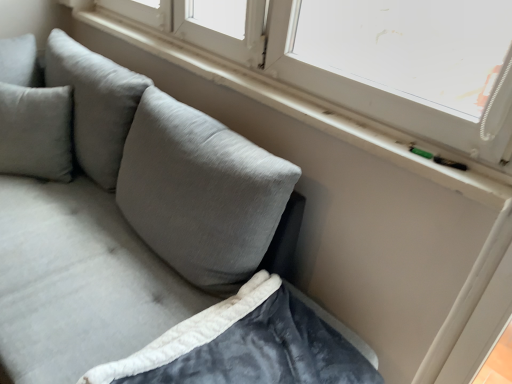
Question: Is velvety dark gray blanket at lower left not close to velvet gray couch at lower left?

Choices:
 (A) yes
 (B) no

Answer: (B)

Question: Is velvety dark gray blanket at lower left aimed at velvet gray couch at lower left?

Choices:
 (A) yes
 (B) no

Answer: (A)

Question: Considering the relative positions of velvety dark gray blanket at lower left and velvet gray couch at lower left in the image provided, is velvety dark gray blanket at lower left to the right of velvet gray couch at lower left from the viewer's perspective?

Choices:
 (A) yes
 (B) no

Answer: (A)

Question: Is velvety dark gray blanket at lower left positioned beyond the bounds of velvet gray couch at lower left?

Choices:
 (A) yes
 (B) no

Answer: (B)

Question: From the image's perspective, would you say velvety dark gray blanket at lower left is shown under velvet gray couch at lower left?

Choices:
 (A) yes
 (B) no

Answer: (A)

Question: Based on their positions, is velvety dark gray blanket at lower left located to the left or right of white plastic window at upper right?

Choices:
 (A) left
 (B) right

Answer: (B)

Question: Considering the positions of velvety dark gray blanket at lower left and white plastic window at upper right in the image, is velvety dark gray blanket at lower left wider or thinner than white plastic window at upper right?

Choices:
 (A) thin
 (B) wide

Answer: (B)

Question: Is velvety dark gray blanket at lower left taller or shorter than white plastic window at upper right?

Choices:
 (A) short
 (B) tall

Answer: (A)

Question: Relative to white plastic window at upper right, is velvety dark gray blanket at lower left in front or behind?

Choices:
 (A) behind
 (B) front

Answer: (B)

Question: In terms of height, does velvety dark gray blanket at lower left look taller or shorter compared to velvet gray couch at lower left?

Choices:
 (A) tall
 (B) short

Answer: (B)

Question: Based on their sizes in the image, would you say velvety dark gray blanket at lower left is bigger or smaller than velvet gray couch at lower left?

Choices:
 (A) big
 (B) small

Answer: (B)

Question: From the image's perspective, is velvety dark gray blanket at lower left located above or below velvet gray couch at lower left?

Choices:
 (A) above
 (B) below

Answer: (B)

Question: From a real-world perspective, is velvety dark gray blanket at lower left above or below velvet gray couch at lower left?

Choices:
 (A) above
 (B) below

Answer: (A)

Question: Is velvet gray couch at lower left bigger or smaller than white plastic window at upper right?

Choices:
 (A) small
 (B) big

Answer: (B)

Question: Looking at their shapes, would you say velvet gray couch at lower left is wider or thinner than white plastic window at upper right?

Choices:
 (A) wide
 (B) thin

Answer: (A)